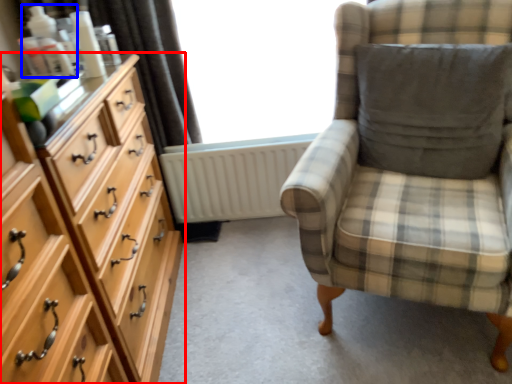
Question: Which of the following is the closest to the observer, chest of drawers (highlighted by a red box) or toiletry (highlighted by a blue box)?

Choices:
 (A) chest of drawers
 (B) toiletry

Answer: (A)